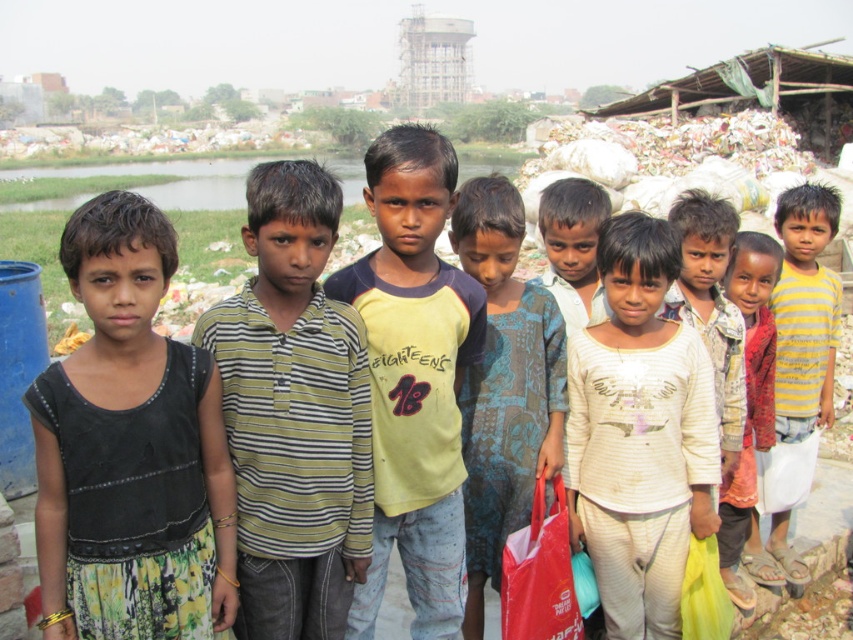
You are a photographer trying to capture a group shot of the children. You notice the striped cotton shirt at center and the yellow cotton shirt at center. Which child should you ask to move closer to ensure both shirts are equally visible in the photo?

The striped cotton shirt at center occupies less space than the yellow cotton shirt at center, so you should ask the child wearing the striped cotton shirt at center to move closer to balance their visibility.

You are a photographer trying to capture both the striped cotton shirt at center and the yellow cotton shirt at center in a single frame. Since the shirts are positioned close to each other, you need to adjust your camera angle to ensure both are fully visible. Considering their widths, which shirt might require you to zoom out slightly more to include its entire width in the photo?

The yellow cotton shirt at center is wider than the striped cotton shirt at center, so you would need to zoom out slightly more to include its entire width in the photo.

You are a photographer trying to capture a group photo of the children. You notice the white striped shirt at center and the light beige cotton shirt at center. Which child should you ask to move slightly to the left to ensure both shirts are visible in the frame?

You should ask the child wearing the light beige cotton shirt at center to move slightly to the left because the white striped shirt at center is wider, and adjusting the narrower one might help balance the composition.